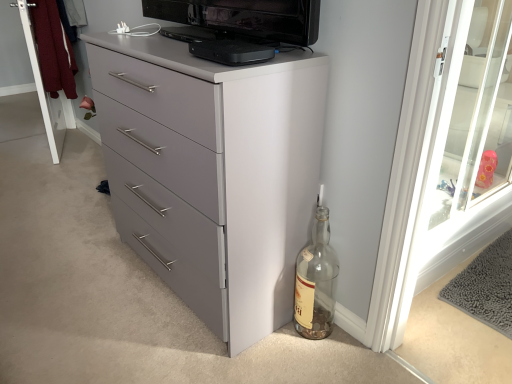
I want to click on vacant space in between matte gray chest of drawers at center and clear glass bottle at lower right, so click(x=269, y=346).